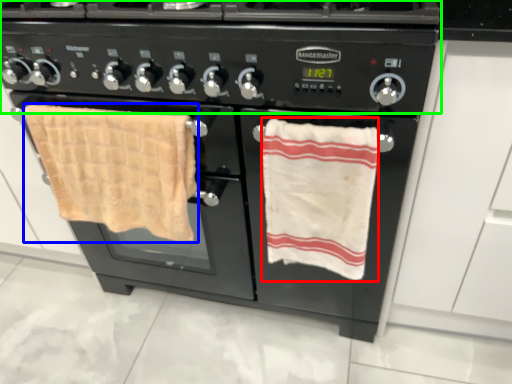
Question: Based on their relative distances, which object is farther from beach towel (highlighted by a red box)? Choose from beach towel (highlighted by a blue box) and gas stove (highlighted by a green box).

Choices:
 (A) beach towel
 (B) gas stove

Answer: (A)